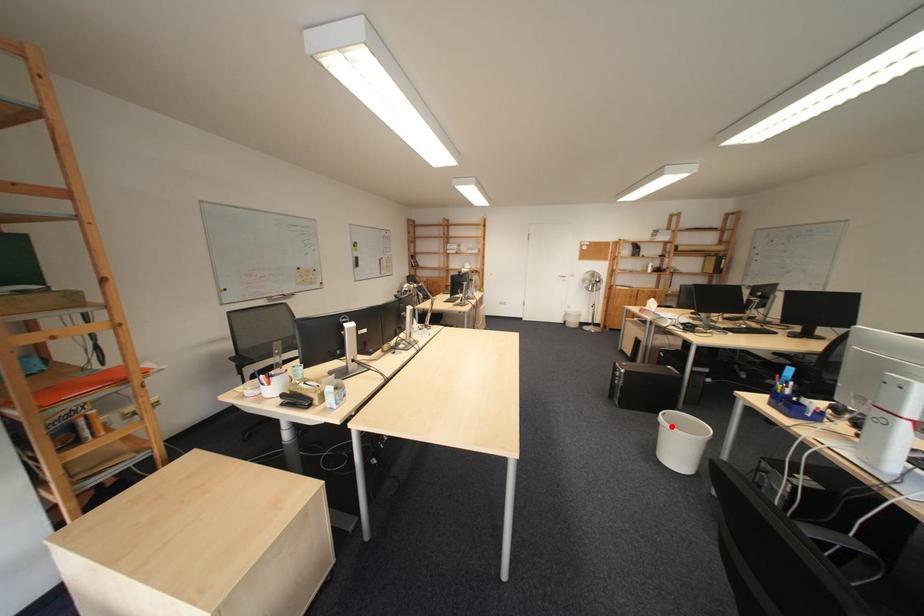
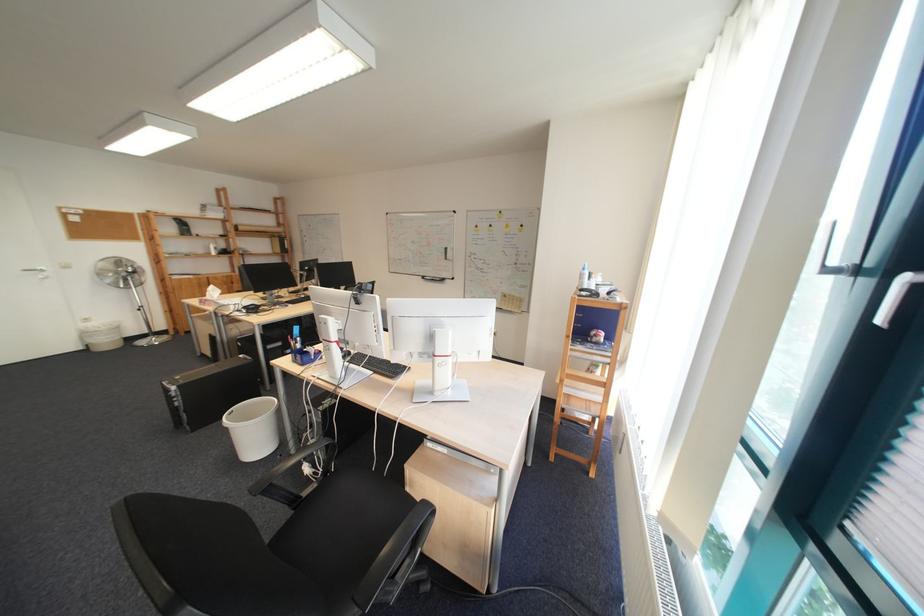
Where in the second image is the point corresponding to the highlighted location from the first image?

(239, 430)